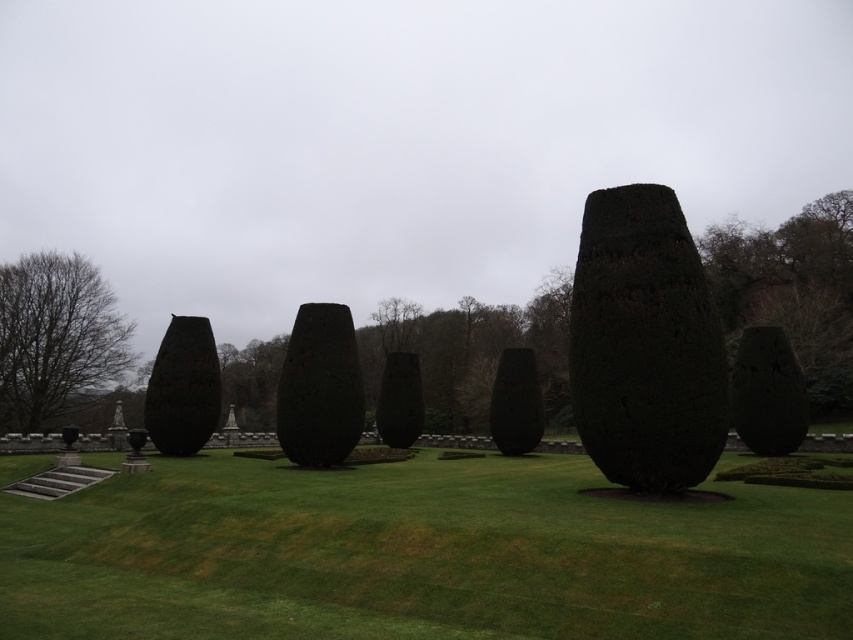
You are standing at the center of the grassy lawn and want to place a new sculpture exactly at the midpoint between the dark brown textured vase at left and another point at coordinates 0.303, 0.432. What are the coordinates of the midpoint where you should place the new sculpture?

The midpoint between the dark brown textured vase at left at coordinates [183,387] and the point [368,193] is calculated by averaging the x and y coordinates. The midpoint coordinates are [276,291].

You are a landscape architect designing a walking path between the dark gray stone vase at center and another similar sculpture 21.71 meters away. What is the minimum width required for the path to ensure a 1.5 meter buffer on both sides of the path?

The minimum width required for the path would be the distance between the two sculptures minus twice the buffer. Since the buffer is 1.5 meters on each side, the total buffer needed is 3 meters. Subtracting this from the 21.71 meters gives 18.71 meters. Therefore, the path must be at least 18.71 meters wide to maintain the required buffer.

Consider the image. You are a landscape architect designing a pathway between the dark brown textured vase at left and the dark green stone vase at center. Based on their positions, which vase should the pathway start from and lead towards?

The pathway should start from the dark brown textured vase at left and lead towards the dark green stone vase at center because the dark brown textured vase at left is positioned over the dark green stone vase at center, indicating it is above or in front of it.